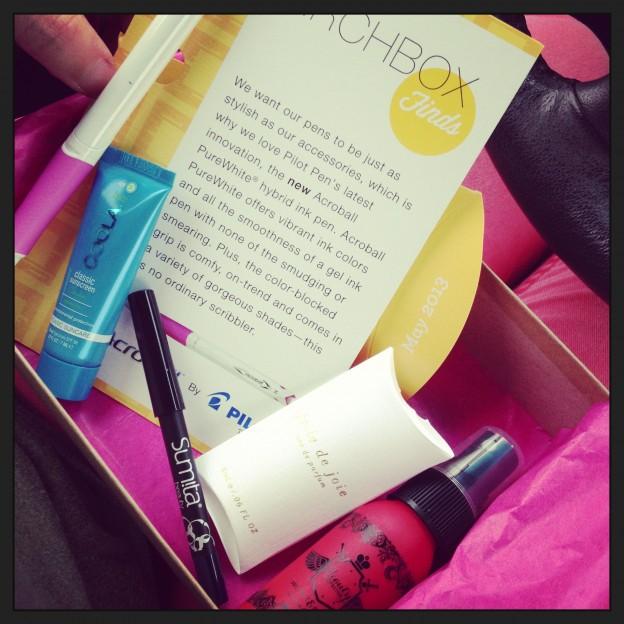
The width and height of the screenshot is (624, 624). Identify the location of spray bottle. (384, 553).